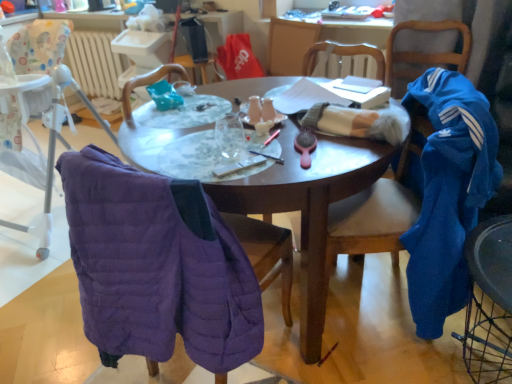
Where is `free location above wooden table at center (from a real-world perspective)`? free location above wooden table at center (from a real-world perspective) is located at coordinates (243, 134).